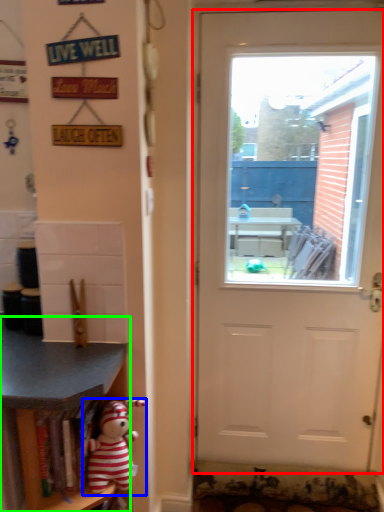
Question: Considering the real-world distances, which object is closest to door (highlighted by a red box)? toy (highlighted by a blue box) or shelf (highlighted by a green box).

Choices:
 (A) toy
 (B) shelf

Answer: (B)